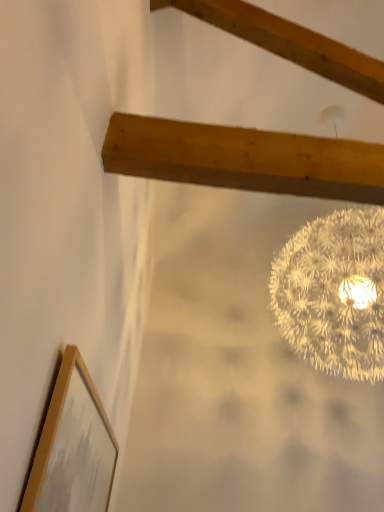
Measure the distance between point (80, 357) and camera.

Point (80, 357) and camera are 1.20 meters apart from each other.

You are a GUI agent. You are given a task and a screenshot of the screen. Output one action in this format:
    pyautogui.click(x=<x>, y=<y>)
    Task: Click on the wooden picture frame at lower left
    
    Given the screenshot: What is the action you would take?
    pyautogui.click(x=73, y=447)

What do you see at coordinates (73, 447) in the screenshot?
I see `wooden picture frame at lower left` at bounding box center [73, 447].

Locate an element on the screen. The height and width of the screenshot is (512, 384). wooden picture frame at lower left is located at coordinates (73, 447).